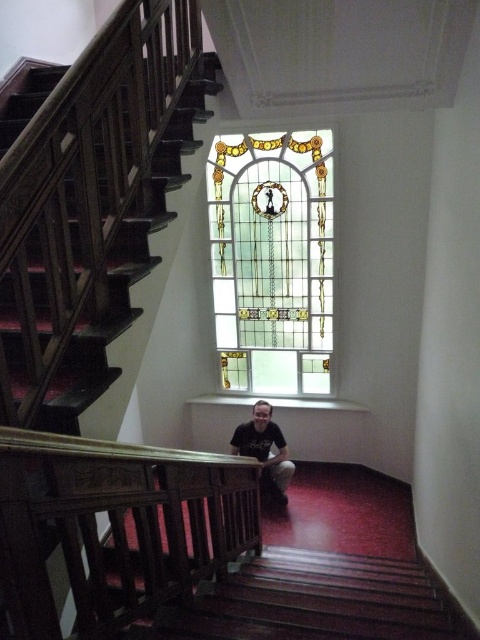
Question: Which of the following is the closest to the observer?

Choices:
 (A) dark brown wooden balustrade at center
 (B) matte black shirt at center

Answer: (A)

Question: Which object is positioned farthest from the dark brown wooden balustrade at center?

Choices:
 (A) stained glass window at center
 (B) matte black shirt at center

Answer: (A)

Question: Can you confirm if dark brown wooden balustrade at center is smaller than matte black shirt at center?

Choices:
 (A) yes
 (B) no

Answer: (B)

Question: Can you confirm if stained glass window at center is positioned to the left of matte black shirt at center?

Choices:
 (A) yes
 (B) no

Answer: (B)

Question: Which object appears closest to the camera in this image?

Choices:
 (A) stained glass window at center
 (B) dark brown wooden balustrade at center

Answer: (B)

Question: Is dark brown wooden balustrade at center smaller than stained glass window at center?

Choices:
 (A) yes
 (B) no

Answer: (B)